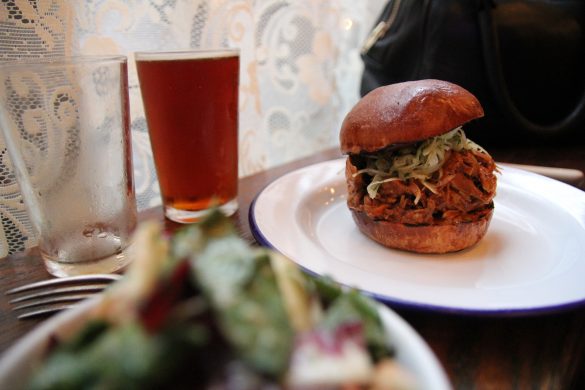
At what (x,y) coordinates should I click in order to perform the action: click on empty glass. Please return your answer as a coordinate pair (x, y). Looking at the image, I should click on (79, 150).